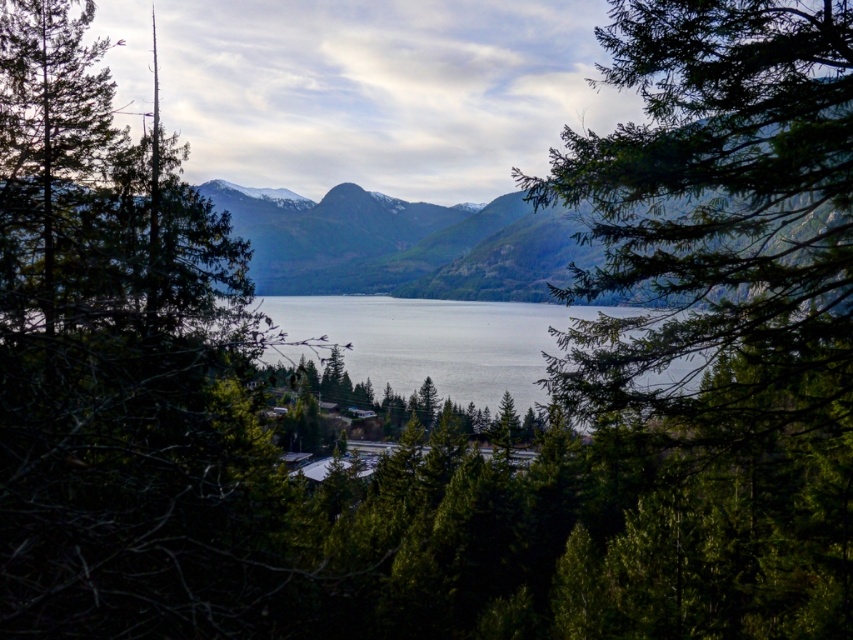
Question: Which is nearer to the green matte tree at left?

Choices:
 (A) green textured mountain at center
 (B) green needle-like leaves at center

Answer: (A)

Question: Is green needle-like leaves at center smaller than green textured mountain at center?

Choices:
 (A) no
 (B) yes

Answer: (B)

Question: Which of these objects is positioned farthest from the green matte tree at left?

Choices:
 (A) green needle-like leaves at center
 (B) green textured mountain at center

Answer: (A)

Question: Can you confirm if green textured mountain at center is thinner than green matte tree at left?

Choices:
 (A) yes
 (B) no

Answer: (B)

Question: Considering the real-world distances, which object is closest to the green matte tree at left?

Choices:
 (A) green textured mountain at center
 (B) green needle-like leaves at center

Answer: (A)

Question: Where is green textured mountain at center located in relation to green matte tree at left in the image?

Choices:
 (A) left
 (B) right

Answer: (B)